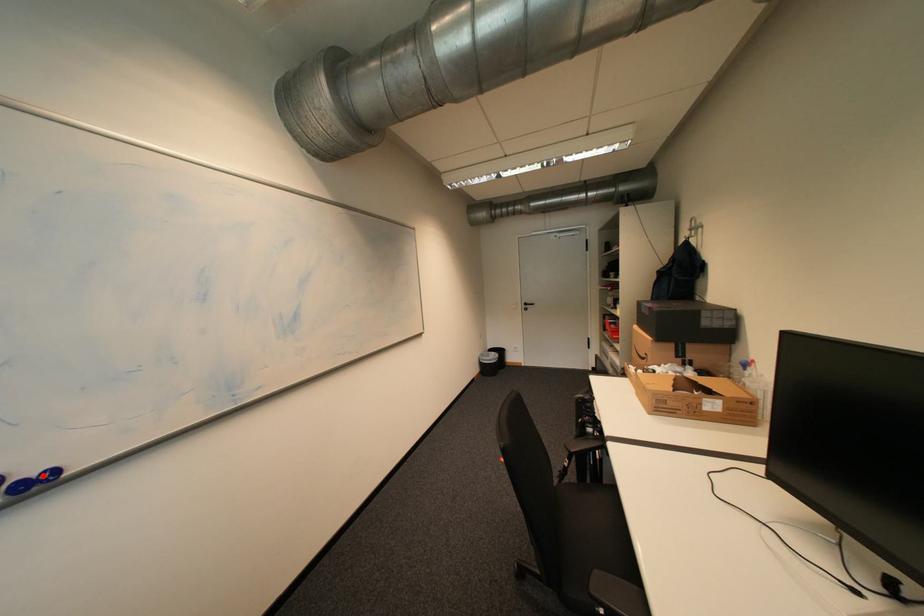
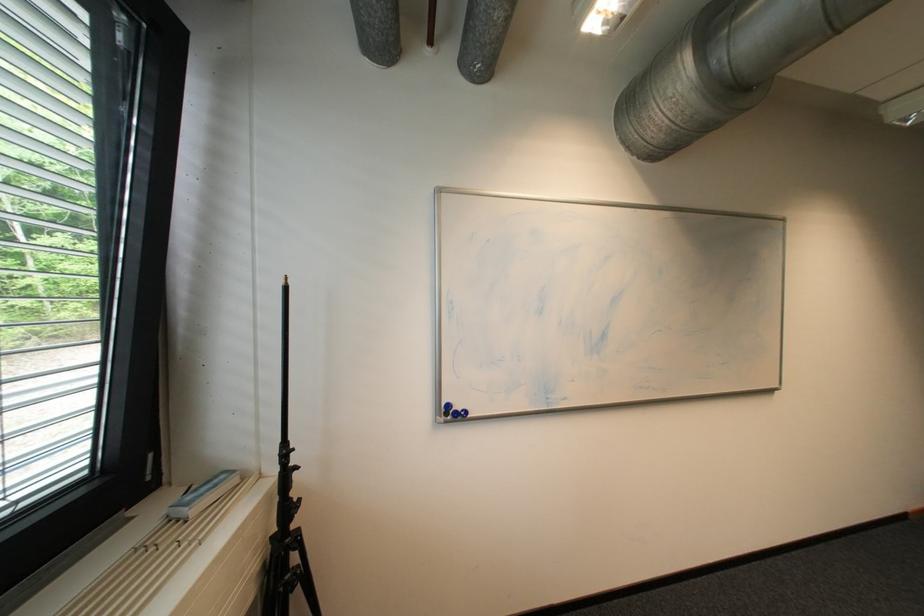
Question: I am providing you with two images of the same scene from different viewpoints. Given a red point in image1, look at the same physical point in image2. Is it:

Choices:
 (A) Closer to the viewpoint
 (B) Farther from the viewpoint

Answer: (B)